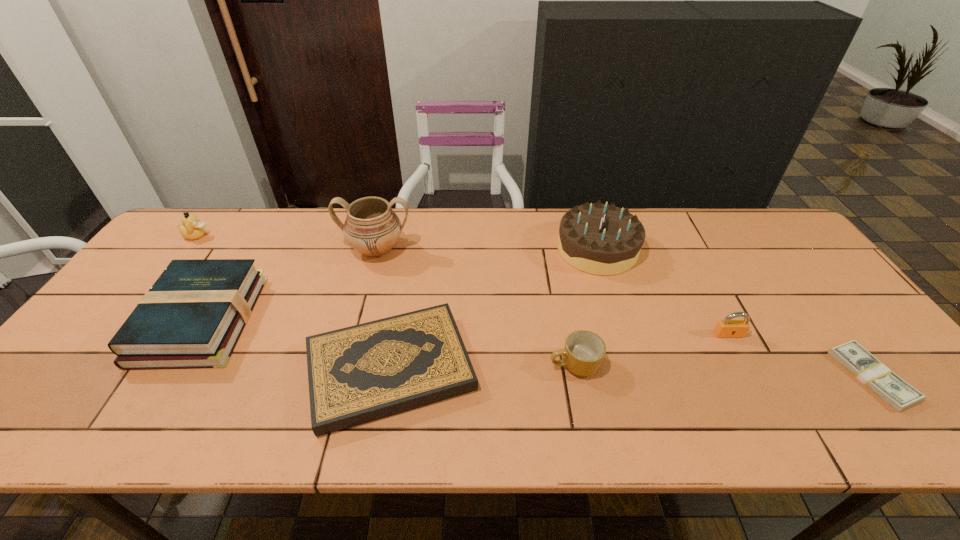
Locate an element on the screen. The height and width of the screenshot is (540, 960). free space located 0.320m on the side with the handle of the mug is located at coordinates (413, 364).

Identify the location of free location located on the back of the seventh tallest object. (409, 266).

You are a GUI agent. You are given a task and a screenshot of the screen. Output one action in this format:
    pyautogui.click(x=<x>, y=<y>)
    Task: Click on the free space located on the back of the shortest object
    
    Given the screenshot: What is the action you would take?
    tap(791, 271)

Locate an element on the screen. The width and height of the screenshot is (960, 540). urn located in the far edge section of the desktop is located at coordinates (372, 228).

Locate an element on the screen. This screenshot has height=540, width=960. birthday cake that is at the far edge is located at coordinates (599, 239).

Where is `duckling located at the far edge`? The image size is (960, 540). duckling located at the far edge is located at coordinates (192, 228).

I want to click on hardback book that is at the near edge, so click(x=358, y=374).

Where is `dollar at the near edge`? dollar at the near edge is located at coordinates (897, 393).

The height and width of the screenshot is (540, 960). I want to click on duckling at the left edge, so [x=192, y=228].

This screenshot has width=960, height=540. What are the coordinates of `hardback book that is at the left edge` in the screenshot? It's located at (192, 317).